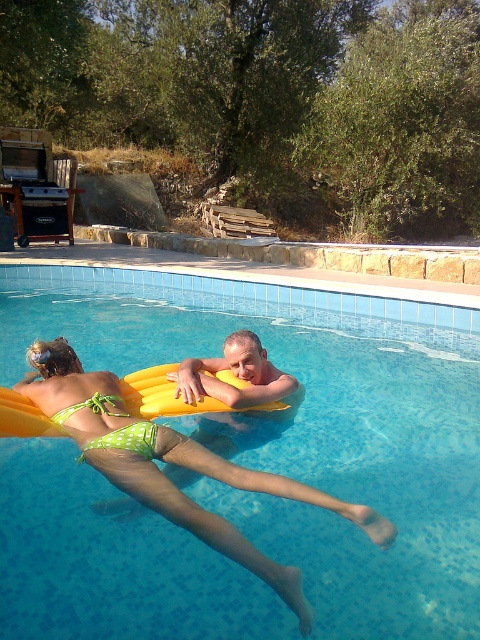
You are planning to place a new rectangular bench in the swimming area. The bench is 1.2 meters wide. Considering the transparent plastic pool at center and the smooth yellow float at center, which object would allow enough space for the bench to be placed next to it without overlapping?

The transparent plastic pool at center is wider than the smooth yellow float at center. Since the bench is 1.2 meters wide, placing it next to the transparent plastic pool at center would provide sufficient space as the pool is wider and can accommodate the bench without overlapping.

You are a lifeguard who needs to check the water level of the transparent plastic pool at center. Since the smooth yellow float at center is in the pool, can you determine if the pool is deeper than the float?

The transparent plastic pool at center has a lesser height compared to smooth yellow float at center, which means the pool is not deeper than the float. Therefore, the water level is below the float.